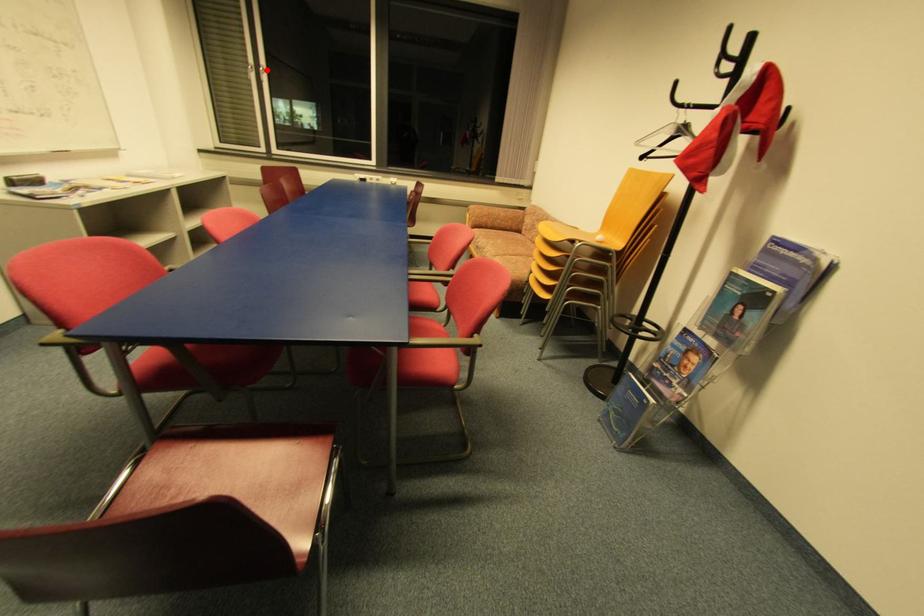
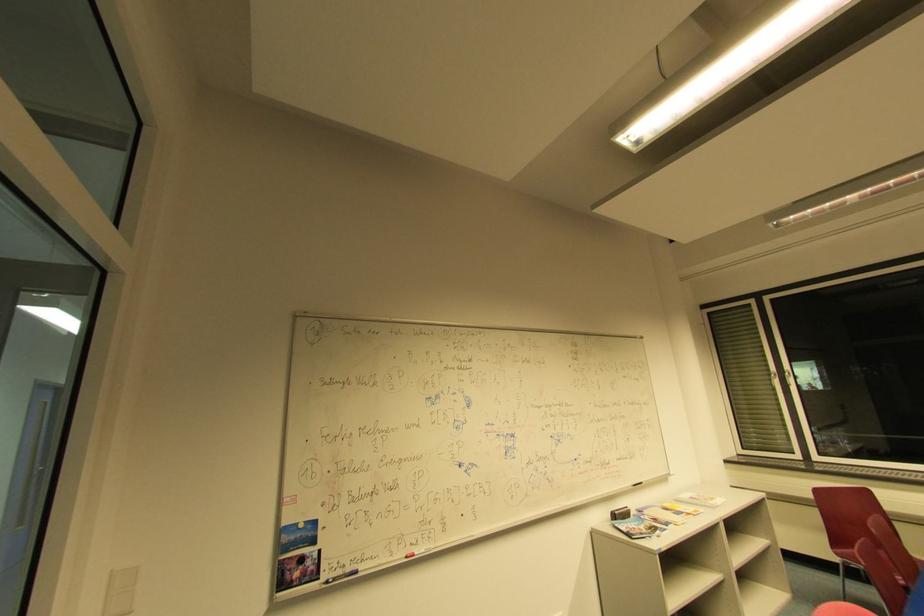
Question: A red point is marked in image1. In image2, is the corresponding 3D point closer to the camera or farther? Reply with the corresponding letter.

Choices:
 (A) The corresponding 3D point is closer.
 (B) The corresponding 3D point is farther.

Answer: (A)